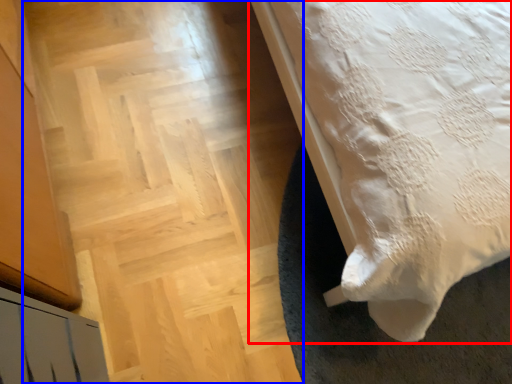
Question: Among these objects, which one is farthest to the camera, bed (highlighted by a red box) or stairwell (highlighted by a blue box)?

Choices:
 (A) bed
 (B) stairwell

Answer: (B)